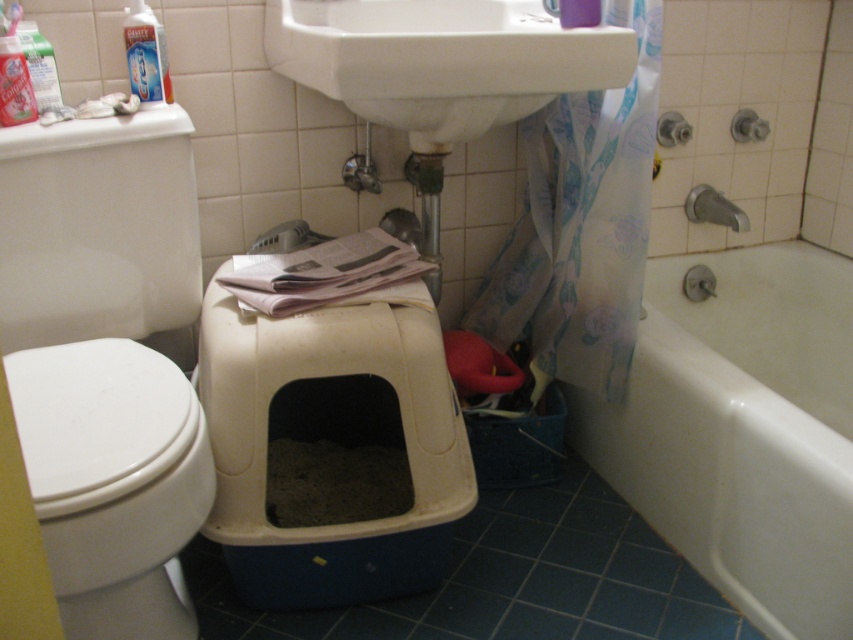
You are a plumber inspecting the bathroom and need to determine which of the two fixtures, the white glossy bathtub at lower right or the white glossy sink at upper center, requires more space for maintenance. Based on their sizes, which one would need more space?

The white glossy bathtub at lower right is bigger than the white glossy sink at upper center, so it would require more space for maintenance.